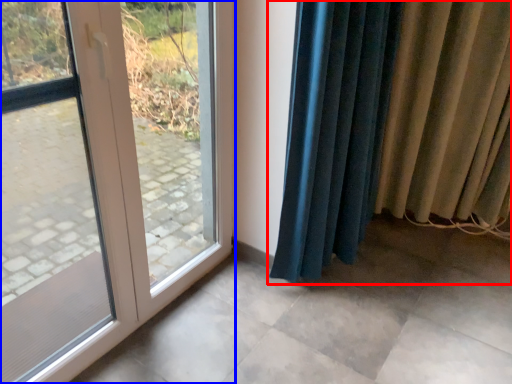
Question: Which point is further to the camera, curtain (highlighted by a red box) or door (highlighted by a blue box)?

Choices:
 (A) curtain
 (B) door

Answer: (A)